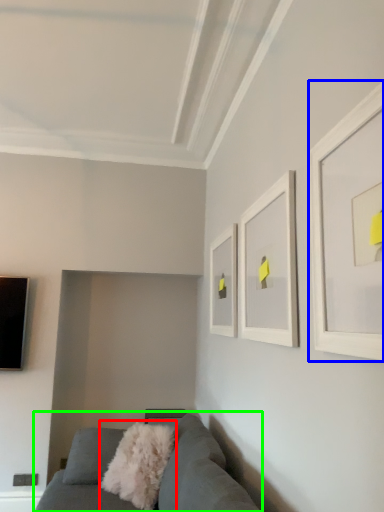
Question: Based on their relative distances, which object is nearer to throw pillow (highlighted by a red box)? Choose from picture frame (highlighted by a blue box) and studio couch (highlighted by a green box).

Choices:
 (A) picture frame
 (B) studio couch

Answer: (B)